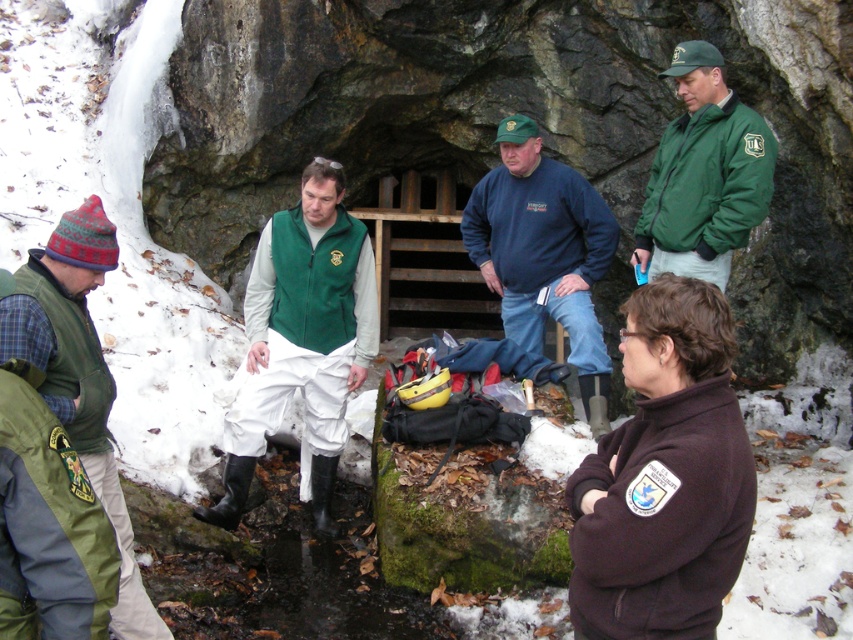
Question: Is blue fleece jacket at center to the right of green fleece vest at left from the viewer's perspective?

Choices:
 (A) no
 (B) yes

Answer: (B)

Question: Which object is farther from the camera taking this photo?

Choices:
 (A) green fleece jacket at upper right
 (B) green fleece vest at left

Answer: (A)

Question: Is blue fleece jacket at center bigger than green fleece vest at left?

Choices:
 (A) no
 (B) yes

Answer: (B)

Question: Is green matte vest at center below blue fleece jacket at center?

Choices:
 (A) no
 (B) yes

Answer: (B)

Question: Which point is closer to the camera?

Choices:
 (A) green fleece jacket at upper right
 (B) blue fleece jacket at center
 (C) green matte vest at center

Answer: (A)

Question: Which point is farther from the camera taking this photo?

Choices:
 (A) (518, 234)
 (B) (701, 264)
 (C) (308, 225)

Answer: (A)